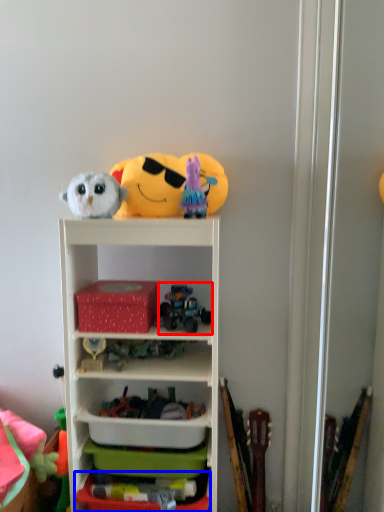
Question: Which point is further to the camera, toy (highlighted by a red box) or storage box (highlighted by a blue box)?

Choices:
 (A) toy
 (B) storage box

Answer: (A)